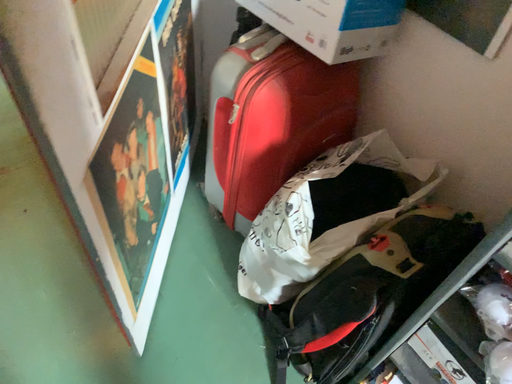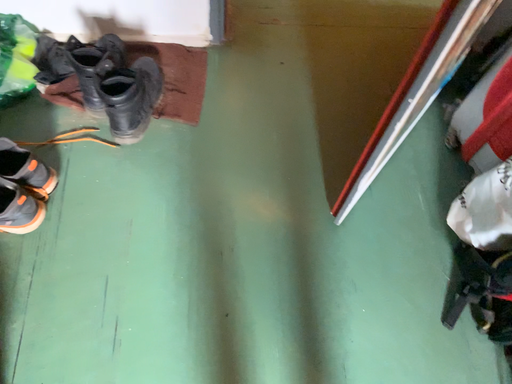
Question: Which way did the camera rotate in the video?

Choices:
 (A) rotated right
 (B) rotated left

Answer: (B)